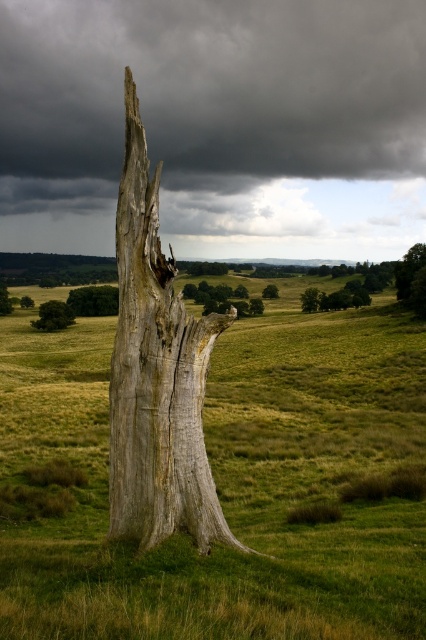
Question: Does gray weathered wood at center have a lesser width compared to green matte tree at lower left?

Choices:
 (A) no
 (B) yes

Answer: (B)

Question: Does green matte tree at lower left lie behind green grassy tree at center?

Choices:
 (A) yes
 (B) no

Answer: (B)

Question: Which of these objects is positioned farthest from the green rough bark tree at center?

Choices:
 (A) gray rough bark tree at center
 (B) green grassy tree at center
 (C) smooth gray tree trunk at center

Answer: (B)

Question: Which object is the closest to the green grassy tree at center?

Choices:
 (A) green grassy at center
 (B) gray weathered wood at center
 (C) green matte tree at lower left
 (D) green leafy tree at upper right

Answer: (C)

Question: Can you confirm if green leafy tree at upper right is positioned below smooth gray tree trunk at center?

Choices:
 (A) yes
 (B) no

Answer: (B)

Question: Which point is closer to the camera?

Choices:
 (A) green grassy tree at center
 (B) green grassy at center
 (C) gray rough bark tree at center
 (D) green leafy tree at upper right

Answer: (B)